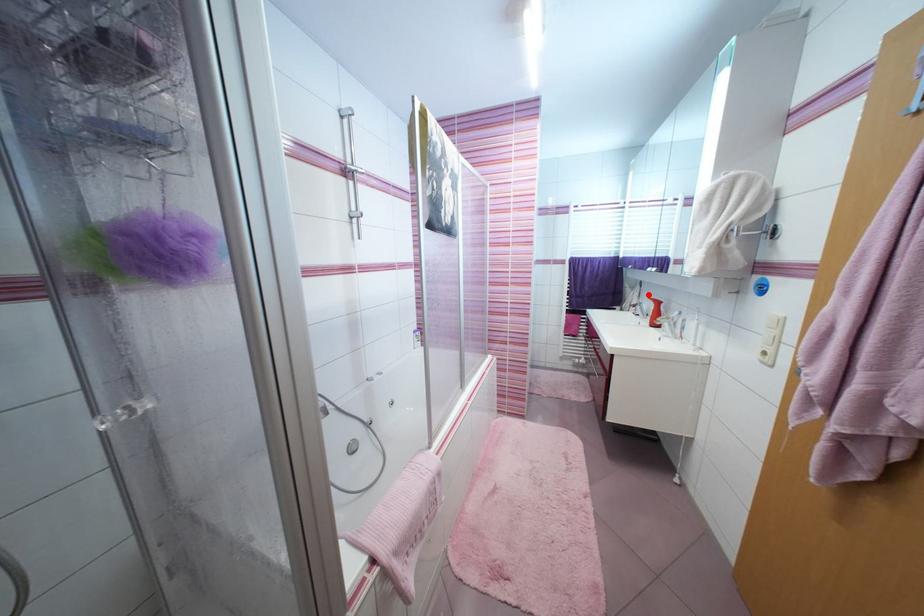
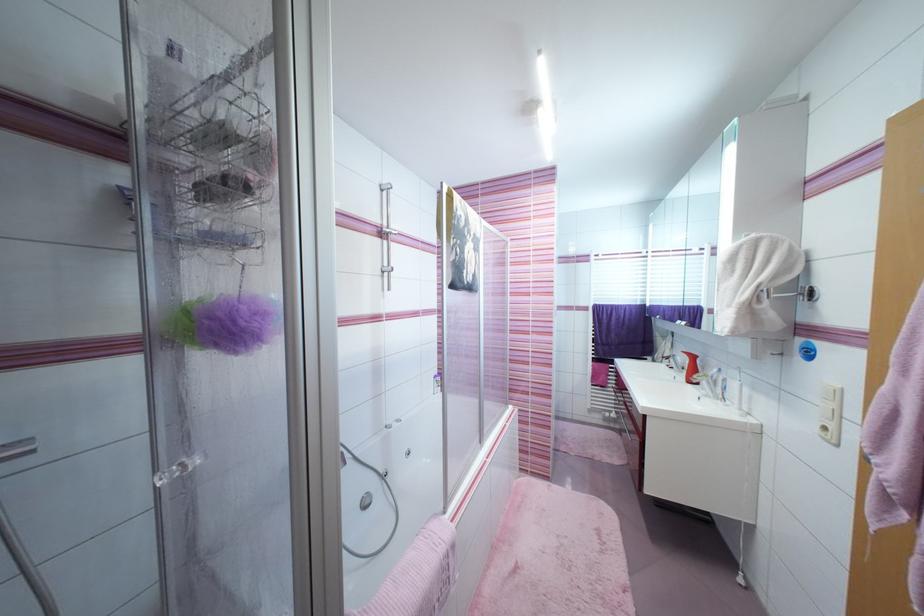
Question: I am providing you with two images of the same scene from different viewpoints. A red point is marked on the first image. Can you still see the location of the red point in image 2?

Choices:
 (A) Yes
 (B) No

Answer: (A)